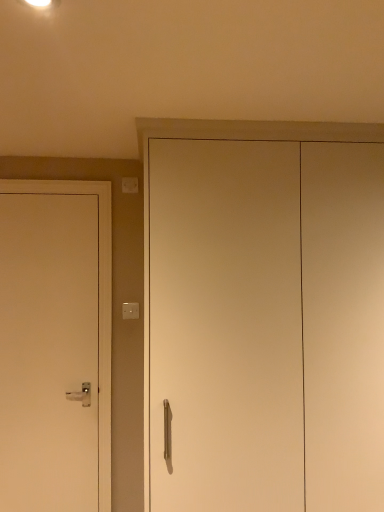
Question: From a real-world perspective, is white matte door at left, which is the first door in left-to-right order, positioned above or below white matte cabinet at center, arranged as the second door when viewed from the left?

Choices:
 (A) below
 (B) above

Answer: (A)

Question: Is white matte door at left, acting as the 2th door starting from the front, in front of or behind white matte cabinet at center, which is the first door in right-to-left order, in the image?

Choices:
 (A) behind
 (B) front

Answer: (A)

Question: Considering the real-world distances, which object is farthest from the white plastic light switch at upper left, the first light switch from the top?

Choices:
 (A) white plastic light switch at upper center, arranged as the 2th light switch when viewed from the top
 (B) white matte door at left, which ranks as the 2th door in right-to-left order
 (C) white matte cabinet at center, which is counted as the first door, starting from the front

Answer: (C)

Question: Which object is the closest to the white matte cabinet at center, which is counted as the second door, starting from the back?

Choices:
 (A) white plastic light switch at upper left, acting as the 2th light switch starting from the bottom
 (B) white matte door at left, which is the first door in left-to-right order
 (C) white plastic light switch at upper center, arranged as the 2th light switch when viewed from the top

Answer: (C)